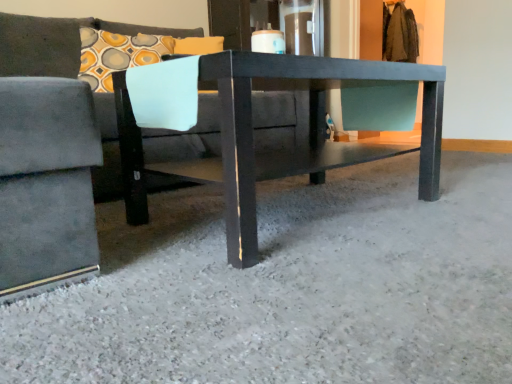
Question: Is velvet gray couch at center far away from matte black table at center?

Choices:
 (A) yes
 (B) no

Answer: (A)

Question: Is velvet gray couch at center smaller than matte black table at center?

Choices:
 (A) no
 (B) yes

Answer: (A)

Question: Is velvet gray couch at center to the left of matte black table at center from the viewer's perspective?

Choices:
 (A) no
 (B) yes

Answer: (B)

Question: Does velvet gray couch at center have a larger size compared to matte black table at center?

Choices:
 (A) no
 (B) yes

Answer: (B)

Question: Is velvet gray couch at center thinner than matte black table at center?

Choices:
 (A) no
 (B) yes

Answer: (A)

Question: Is matte black table at center a part of velvet gray couch at center?

Choices:
 (A) no
 (B) yes

Answer: (B)

Question: Does matte black table at center lie in front of velvet gray couch at center?

Choices:
 (A) no
 (B) yes

Answer: (A)

Question: Considering the relative sizes of matte black table at center and velvet gray couch at center in the image provided, is matte black table at center wider than velvet gray couch at center?

Choices:
 (A) no
 (B) yes

Answer: (A)

Question: From a real-world perspective, is matte black table at center below velvet gray couch at center?

Choices:
 (A) no
 (B) yes

Answer: (B)

Question: Is matte black table at center further to camera compared to velvet gray couch at center?

Choices:
 (A) no
 (B) yes

Answer: (B)

Question: Is matte black table at center smaller than velvet gray couch at center?

Choices:
 (A) no
 (B) yes

Answer: (B)

Question: From the image's perspective, does matte black table at center appear higher than velvet gray couch at center?

Choices:
 (A) yes
 (B) no

Answer: (B)

Question: Can you confirm if velvet gray couch at center is shorter than smooth gray carpet at center?

Choices:
 (A) yes
 (B) no

Answer: (B)